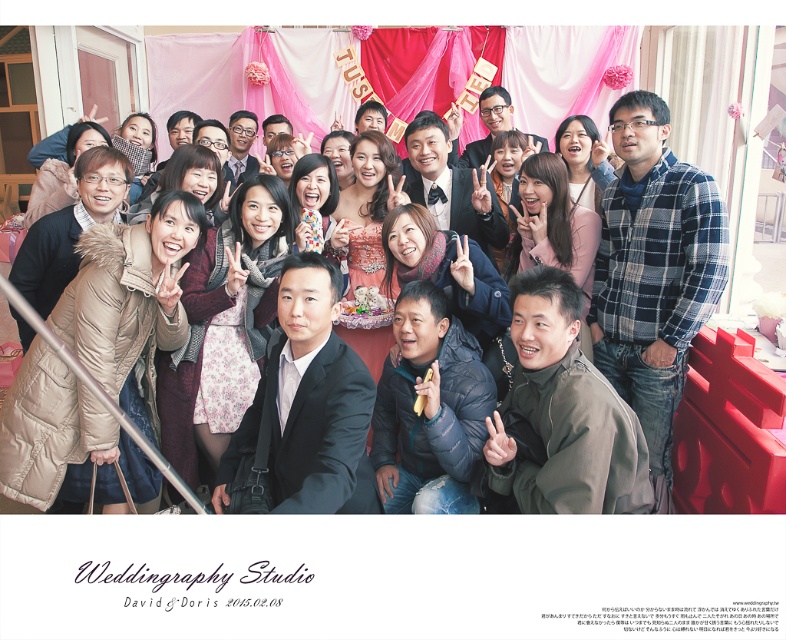
Question: Among these points, which one is farthest from the camera?

Choices:
 (A) (101, 173)
 (B) (421, 134)

Answer: (B)

Question: Which point is closer to the camera?

Choices:
 (A) matte black jacket at center
 (B) matte black dress at center

Answer: (A)

Question: Does blue plaid shirt at center lie in front of matte black jacket at center?

Choices:
 (A) yes
 (B) no

Answer: (A)

Question: Can you confirm if blue plaid shirt at center is positioned to the right of matte black jacket at center?

Choices:
 (A) yes
 (B) no

Answer: (A)

Question: Is blue plaid shirt at center bigger than matte black dress at center?

Choices:
 (A) yes
 (B) no

Answer: (A)

Question: Which point appears closest to the camera in this image?

Choices:
 (A) (616, 358)
 (B) (19, 272)
 (C) (461, 232)

Answer: (A)